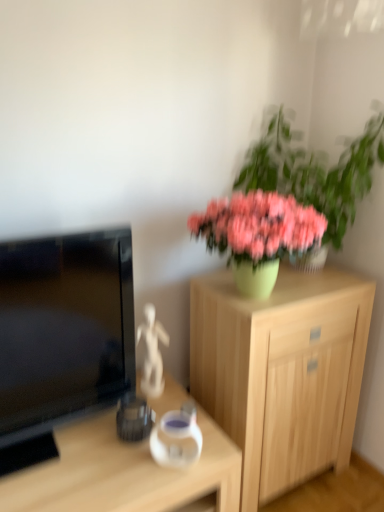
Find the location of a particular element. The image size is (384, 512). free location in front of transparent glass vase at center is located at coordinates (161, 484).